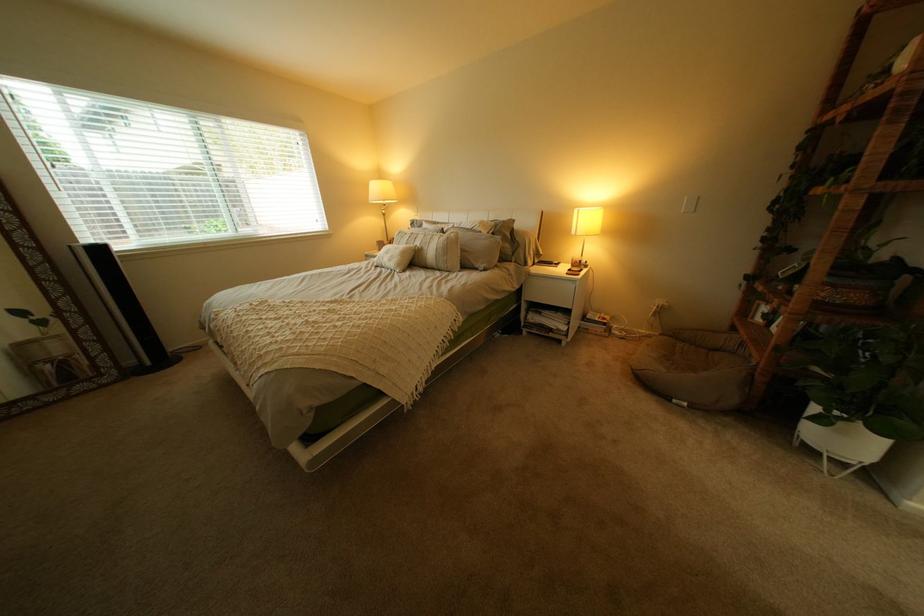
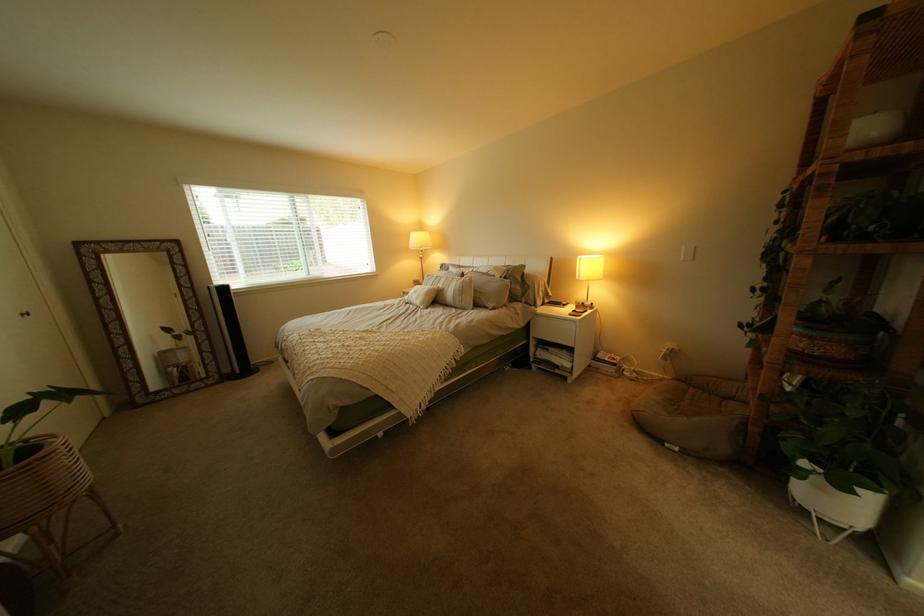
In the second image, find the point that corresponds to point 468,236 in the first image.

(482, 280)